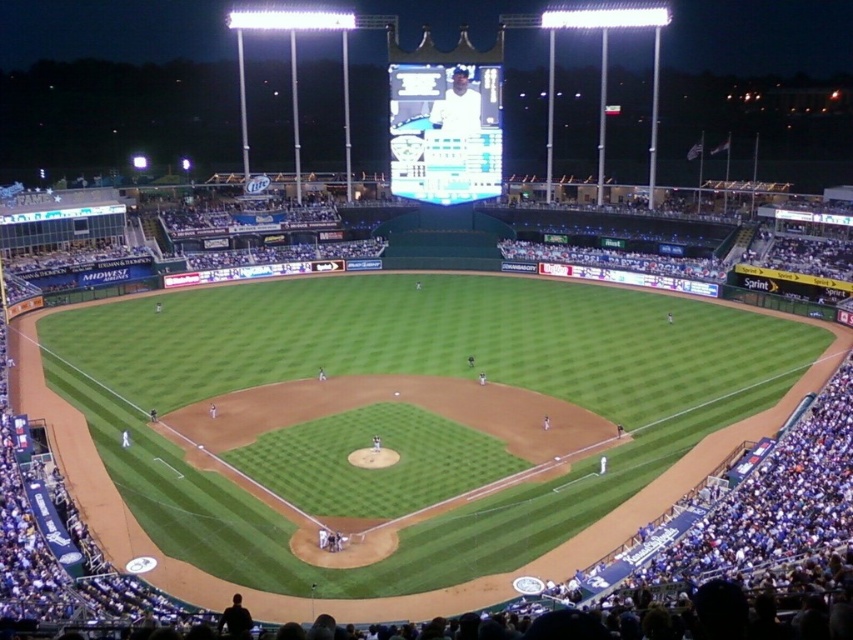
You are a photographer at the baseball stadium and want to capture a photo of the white glossy scoreboard at upper center and the white matte uniform at upper center. From your current position, which object is located to the left?

The white glossy scoreboard at upper center is positioned on the left side of the white matte uniform at upper center, so the white glossy scoreboard at upper center is on the left.

You are a photographer at the baseball stadium and want to capture a photo that includes both the white glossy scoreboard at upper center and the white matte uniform at upper center. Considering their widths, which object should you frame first to ensure both fit in the shot?

The white glossy scoreboard at upper center is wider than the white matte uniform at upper center, so you should frame the white glossy scoreboard at upper center first to ensure both fit in the shot.

You are a photographer trying to capture the scoreboard and the uniform in the upper center of the image. Which object should you focus on first if you want to take a clear photo of both the white glossy scoreboard at upper center and the white matte uniform at upper center?

You should focus on the white glossy scoreboard at upper center first because it is positioned under the white matte uniform at upper center, meaning it is closer to the camera. By focusing on the closer object first, you can ensure both are in the frame and properly focused.